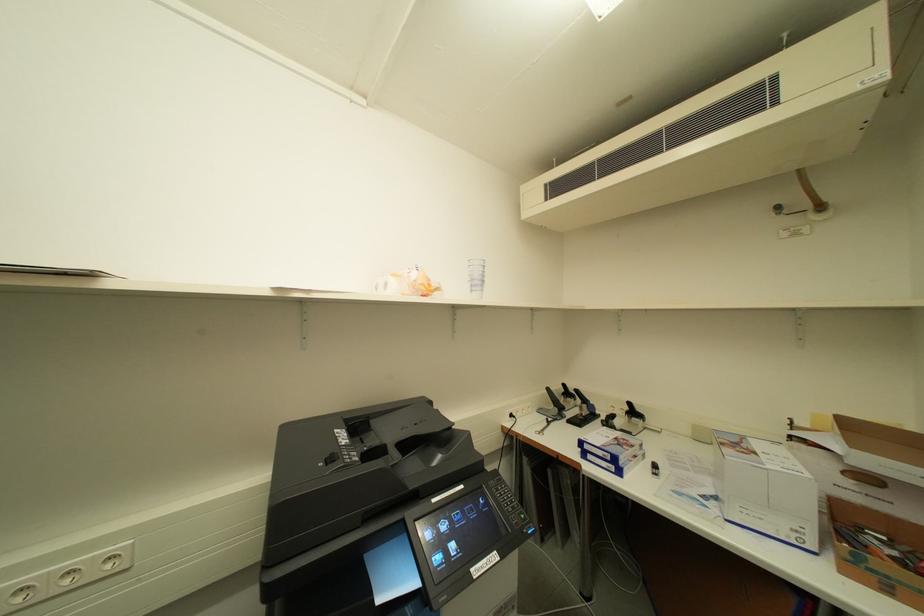
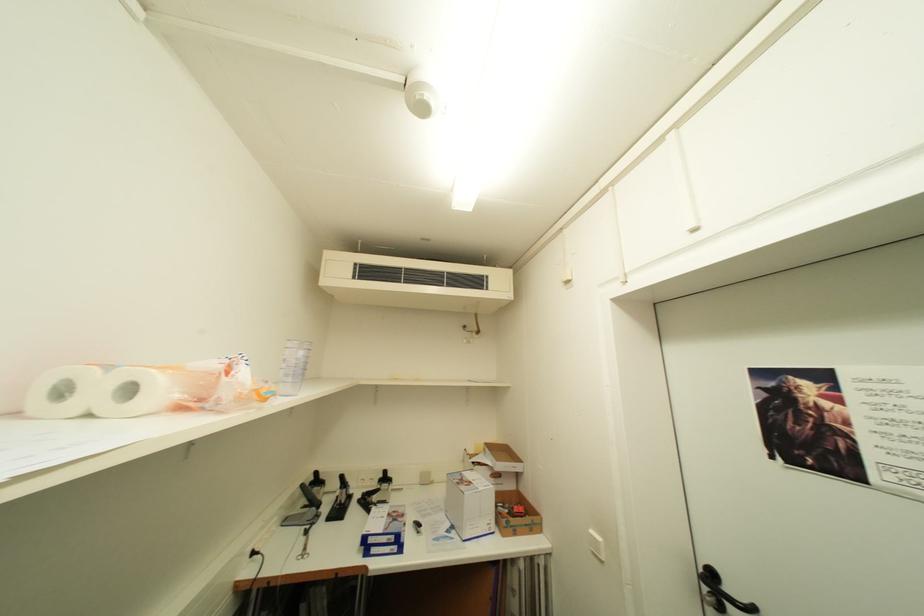
Question: The camera is either moving clockwise (left) or counter-clockwise (right) around the object. The first image is from the beginning of the video and the second image is from the end. Is the camera moving left or right when shooting the video?

Choices:
 (A) Left
 (B) Right

Answer: (A)